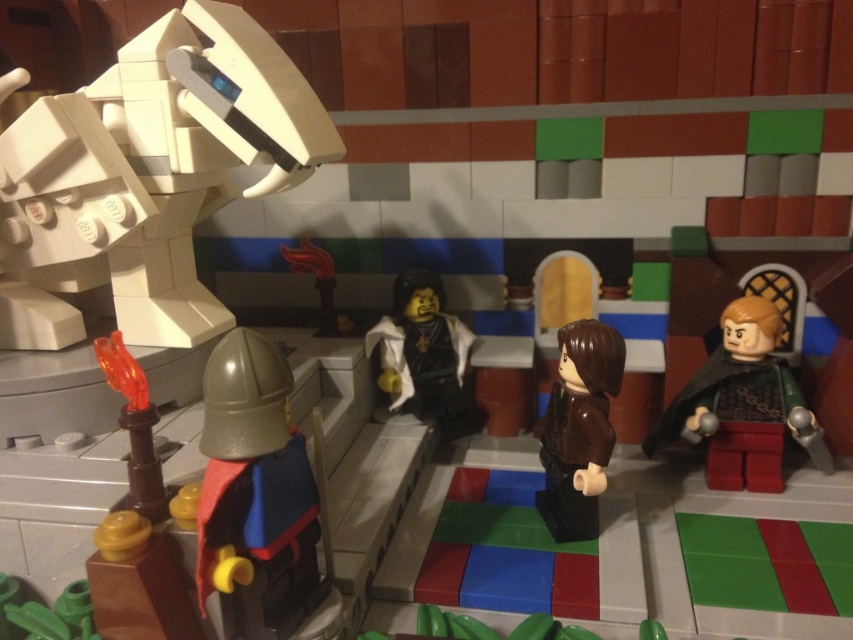
Between point (602, 396) and point (329, 260), which one is positioned behind?

The point (329, 260) is more distant.

Between point (556, 516) and point (300, 266), which one is positioned in front?

Positioned in front is point (556, 516).

Is point (550, 468) more distant than point (329, 291)?

No, (550, 468) is closer to viewer.

Identify the location of brown matte jacket at center. This screenshot has width=853, height=640. (578, 428).

Can you confirm if metallic silver helmet at lower left is thinner than green metallic armor at right?

Indeed, metallic silver helmet at lower left has a lesser width compared to green metallic armor at right.

Which is above, metallic silver helmet at lower left or green metallic armor at right?

green metallic armor at right

Does point (204, 438) come behind point (804, 412)?

No, it is not.

Locate an element on the screen. metallic silver helmet at lower left is located at coordinates (260, 492).

Between green metallic armor at right and brown matte jacket at center, which one has more height?

brown matte jacket at center is taller.

Which is above, green metallic armor at right or brown matte jacket at center?

green metallic armor at right is above.

Locate an element on the screen. green metallic armor at right is located at coordinates (743, 404).

Image resolution: width=853 pixels, height=640 pixels. What are the coordinates of `green metallic armor at right` in the screenshot? It's located at (743, 404).